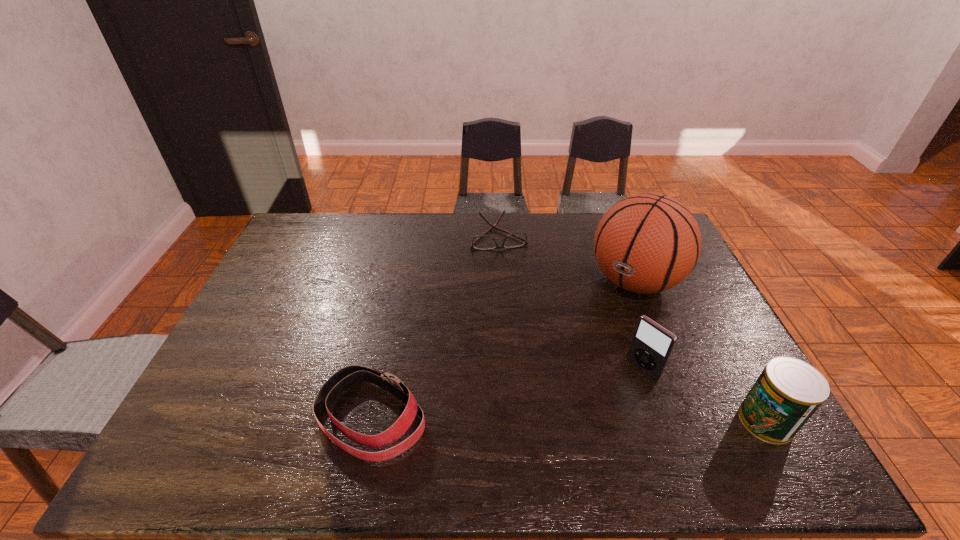
The width and height of the screenshot is (960, 540). What are the coordinates of `vacant space on the desktop that is between the leftmost object and the can and is positioned on the front-facing side of the shortest object` in the screenshot? It's located at (544, 418).

The image size is (960, 540). Identify the location of free space on the desktop that is between the leftmost object and the can and is positioned on the front-facing side of the iPod. (584, 419).

This screenshot has width=960, height=540. In order to click on vacant space on the desktop that is between the dog collar and the can and is positioned on the side where the inflation valve is located in this screenshot , I will do (520, 418).